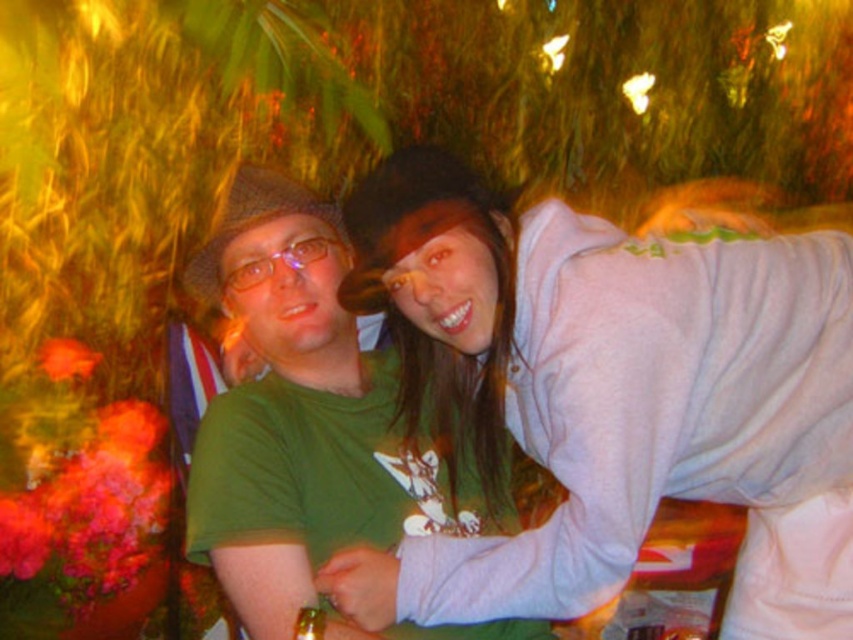
Question: Can you confirm if white soft sweatshirt at upper right is positioned above green matte shirt at center?

Choices:
 (A) yes
 (B) no

Answer: (A)

Question: Is white soft sweatshirt at upper right positioned at the back of green matte shirt at center?

Choices:
 (A) no
 (B) yes

Answer: (A)

Question: Which point is closer to the camera?

Choices:
 (A) (259, 179)
 (B) (358, 250)

Answer: (B)

Question: Which point is farther from the camera taking this photo?

Choices:
 (A) (376, 492)
 (B) (431, 316)

Answer: (A)

Question: In this image, where is white soft sweatshirt at upper right located relative to green matte shirt at center?

Choices:
 (A) right
 (B) left

Answer: (A)

Question: Which point appears farthest from the camera in this image?

Choices:
 (A) (761, 268)
 (B) (521, 625)

Answer: (B)